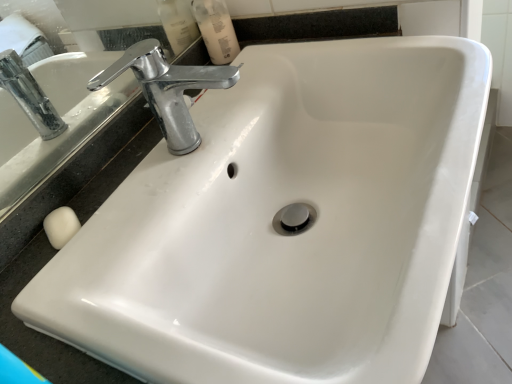
Question: Is chrome metallic faucet at upper left bigger or smaller than translucent plastic mouthwash at upper center?

Choices:
 (A) big
 (B) small

Answer: (A)

Question: From the image's perspective, is chrome metallic faucet at upper left positioned above or below translucent plastic mouthwash at upper center?

Choices:
 (A) above
 (B) below

Answer: (B)

Question: From a real-world perspective, is chrome metallic faucet at upper left physically located above or below translucent plastic mouthwash at upper center?

Choices:
 (A) below
 (B) above

Answer: (B)

Question: Considering the positions of point (202, 9) and point (200, 72), is point (202, 9) closer or farther from the camera than point (200, 72)?

Choices:
 (A) farther
 (B) closer

Answer: (A)

Question: Is translucent plastic mouthwash at upper center taller or shorter than chrome metallic faucet at upper left?

Choices:
 (A) tall
 (B) short

Answer: (B)

Question: Relative to chrome metallic faucet at upper left, is translucent plastic mouthwash at upper center in front or behind?

Choices:
 (A) front
 (B) behind

Answer: (B)

Question: Based on their positions, is translucent plastic mouthwash at upper center located to the left or right of chrome metallic faucet at upper left?

Choices:
 (A) right
 (B) left

Answer: (B)